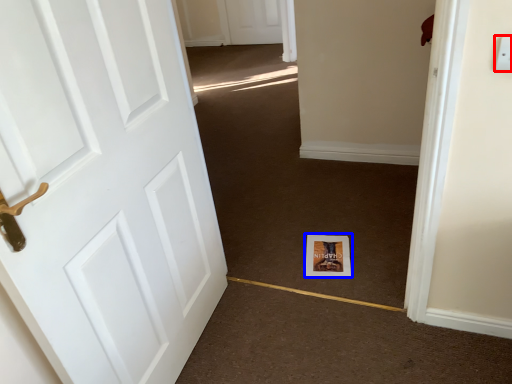
Question: Which of the following is the closest to the observer, electric outlet (highlighted by a red box) or print (highlighted by a blue box)?

Choices:
 (A) electric outlet
 (B) print

Answer: (A)